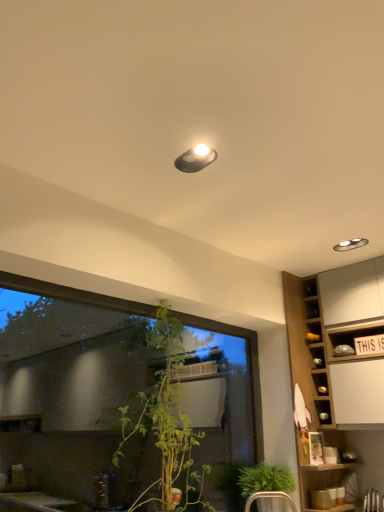
Question: Is transparent glass window at center smaller than green leafy plant at lower center?

Choices:
 (A) yes
 (B) no

Answer: (B)

Question: Considering the relative sizes of transparent glass window at center and green leafy plant at lower center in the image provided, is transparent glass window at center bigger than green leafy plant at lower center?

Choices:
 (A) no
 (B) yes

Answer: (B)

Question: Is transparent glass window at center oriented towards green leafy plant at lower center?

Choices:
 (A) no
 (B) yes

Answer: (B)

Question: Can green leafy plant at lower center be found inside transparent glass window at center?

Choices:
 (A) yes
 (B) no

Answer: (B)

Question: Can you confirm if transparent glass window at center is wider than green leafy plant at lower center?

Choices:
 (A) yes
 (B) no

Answer: (B)

Question: Does point (288, 498) appear closer or farther from the camera than point (205, 145)?

Choices:
 (A) farther
 (B) closer

Answer: (A)

Question: From the image's perspective, is green leafy plant at lower center above or below matte black light fixture at upper center?

Choices:
 (A) above
 (B) below

Answer: (B)

Question: Considering the positions of green leafy plant at lower center and matte black light fixture at upper center in the image, is green leafy plant at lower center taller or shorter than matte black light fixture at upper center?

Choices:
 (A) short
 (B) tall

Answer: (B)

Question: From a real-world perspective, is green leafy plant at lower center positioned above or below matte black light fixture at upper center?

Choices:
 (A) below
 (B) above

Answer: (A)

Question: From the image's perspective, is metallic silver armchair at lower center positioned above or below transparent glass window at center?

Choices:
 (A) below
 (B) above

Answer: (A)

Question: From a real-world perspective, is metallic silver armchair at lower center above or below transparent glass window at center?

Choices:
 (A) below
 (B) above

Answer: (A)

Question: In the image, is metallic silver armchair at lower center positioned in front of or behind transparent glass window at center?

Choices:
 (A) behind
 (B) front

Answer: (A)

Question: In terms of width, does metallic silver armchair at lower center look wider or thinner when compared to transparent glass window at center?

Choices:
 (A) thin
 (B) wide

Answer: (B)

Question: Is point (9, 275) closer or farther from the camera than point (296, 430)?

Choices:
 (A) farther
 (B) closer

Answer: (B)

Question: Is transparent glass window at center to the left or to the right of wooden cabinet at right in the image?

Choices:
 (A) right
 (B) left

Answer: (B)